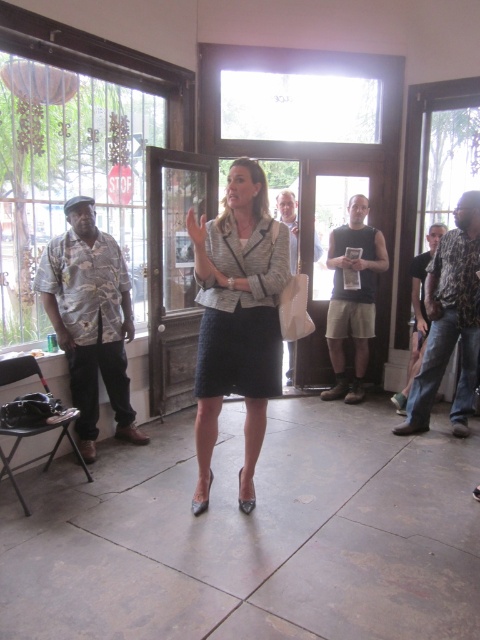
Question: Which point appears farthest from the camera in this image?

Choices:
 (A) (374, 243)
 (B) (266, 328)

Answer: (A)

Question: Considering the relative positions of textured gray dress at center and camouflage shirt at right in the image provided, where is textured gray dress at center located with respect to camouflage shirt at right?

Choices:
 (A) below
 (B) above

Answer: (A)

Question: Estimate the real-world distances between objects in this image. Which object is closer to the black textured skirt at center?

Choices:
 (A) tan fabric shorts at center
 (B) camouflage shirt at left
 (C) floral-patterned shirt at right
 (D) light brown textured bag at center

Answer: (B)

Question: Which point is farther from the camera taking this photo?

Choices:
 (A) (296, 257)
 (B) (254, 337)

Answer: (A)

Question: Is textured gray dress at center bigger than tan fabric shorts at center?

Choices:
 (A) yes
 (B) no

Answer: (B)

Question: Does floral-patterned shirt at right appear over black textured skirt at center?

Choices:
 (A) yes
 (B) no

Answer: (A)